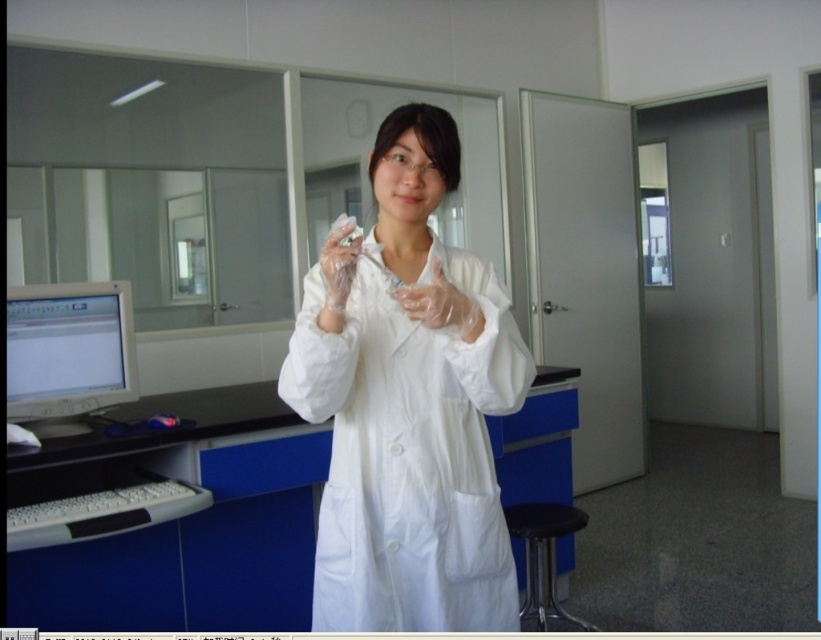
Does matte gray monitor at left have a greater width compared to clear plastic glove at center?

Correct, the width of matte gray monitor at left exceeds that of clear plastic glove at center.

Between matte gray monitor at left and clear plastic glove at center, which one appears on the right side from the viewer's perspective?

From the viewer's perspective, clear plastic glove at center appears more on the right side.

At what (x,y) coordinates should I click in order to perform the action: click on matte gray monitor at left. Please return your answer as a coordinate pair (x, y). The width and height of the screenshot is (821, 640). Looking at the image, I should click on (67, 353).

Which is below, white lab coat at center or matte gray monitor at left?

white lab coat at center is below.

Who is more forward, (384, 140) or (26, 355)?

Point (384, 140) is more forward.

Image resolution: width=821 pixels, height=640 pixels. What are the coordinates of `white lab coat at center` in the screenshot? It's located at (406, 406).

Is point (328, 577) in front of point (511, 532)?

That is True.

This screenshot has height=640, width=821. Identify the location of white lab coat at center. (406, 406).

Where is `white lab coat at center`? white lab coat at center is located at coordinates (406, 406).